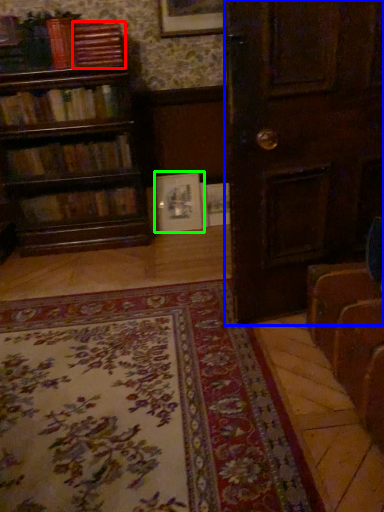
Question: Based on their relative distances, which object is farther from book (highlighted by a red box)? Choose from door (highlighted by a blue box) and picture frame (highlighted by a green box).

Choices:
 (A) door
 (B) picture frame

Answer: (A)